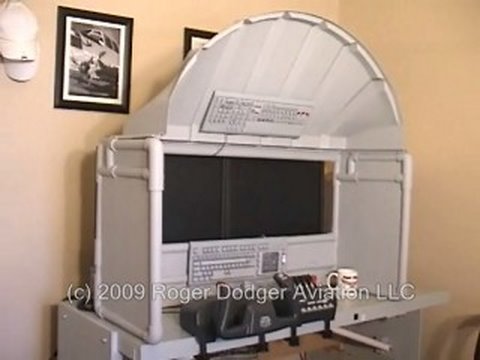
At what (x,y) coordinates should I click in order to perform the action: click on picture frame of man kayaking in black and white. Please return your answer as a coordinate pair (x, y). Looking at the image, I should click on (89, 61).